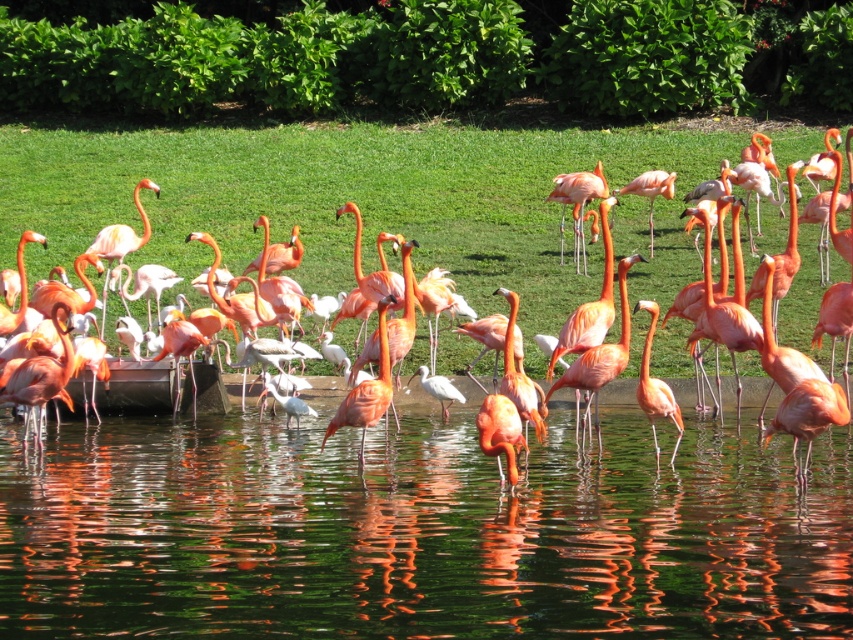
Is point (201, 172) farther from camera compared to point (657, 452)?

That is True.

Measure the distance between point (54,246) and camera.

Point (54,246) is 27.60 meters from camera.

Does point (467, 147) come farther from viewer compared to point (680, 420)?

Yes.

Find the location of a particular element. This screenshot has height=640, width=853. pink feathered flamingo at center is located at coordinates (357, 202).

Can you confirm if green reflective water at center is positioned below pink feathered flamingo at center?

Correct, green reflective water at center is located below pink feathered flamingo at center.

Is green reflective water at center shorter than pink feathered flamingo at center?

Indeed, green reflective water at center has a lesser height compared to pink feathered flamingo at center.

Does point (13, 438) come in front of point (125, 180)?

Yes, it is.

Find the location of a particular element. green reflective water at center is located at coordinates (419, 532).

Locate an element on the screen. green reflective water at center is located at coordinates (419, 532).

Who is positioned more to the right, green reflective water at center or pink matte flamingo at center?

Positioned to the right is pink matte flamingo at center.

Which is behind, point (547, 524) or point (657, 392)?

The point (657, 392) is more distant.

Identify the location of green reflective water at center. This screenshot has height=640, width=853. (419, 532).